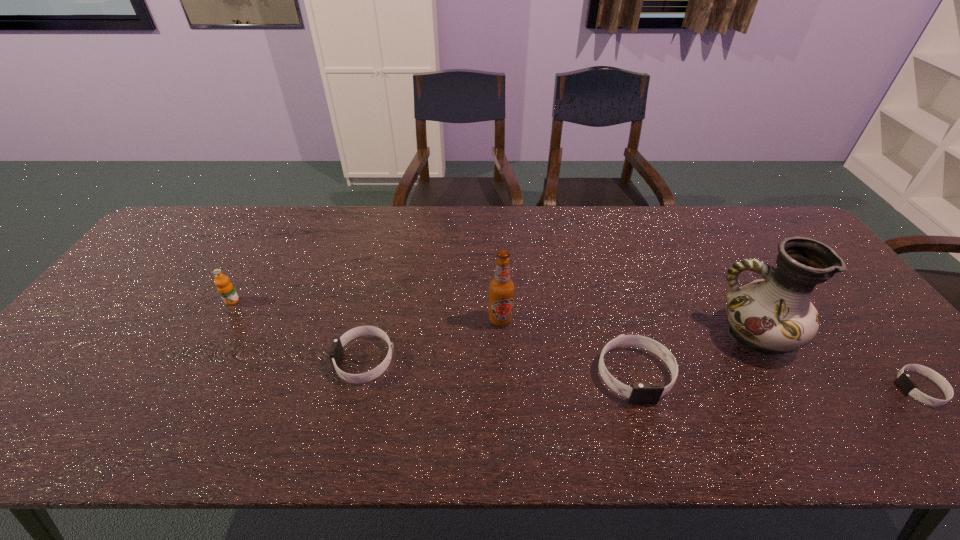
This screenshot has height=540, width=960. Identify the location of vacant area that lies between the leftmost wristband and the fifth object from left to right. (561, 348).

I want to click on free space between the second tallest wristband and the second tallest object, so click(x=433, y=340).

This screenshot has width=960, height=540. I want to click on blank region between the second object from left to right and the tallest object, so click(561, 348).

Identify the location of vacant area that lies between the shortest wristband and the orange juice. (576, 345).

The image size is (960, 540). I want to click on empty space between the fourth object from left to right and the tallest object, so click(x=695, y=354).

Locate an element on the screen. object that is the third closest one to the tallest object is located at coordinates (501, 287).

This screenshot has width=960, height=540. Identify the location of object that stands as the closest to the beer bottle. (640, 393).

Identify which wristband is located as the second nearest to the rightmost wristband. Please provide its 2D coordinates. Your answer should be formatted as a tuple, i.e. [(x, y)], where the tuple contains the x and y coordinates of a point satisfying the conditions above.

[(336, 352)]

The image size is (960, 540). I want to click on the second closest wristband to the tallest object, so click(904, 381).

This screenshot has height=540, width=960. Find the location of `blank space that satisfies the following two spatial constraints: 1. on the front label of the beer bottle; 2. on the outer surface of the fifth object from right to left`. blank space that satisfies the following two spatial constraints: 1. on the front label of the beer bottle; 2. on the outer surface of the fifth object from right to left is located at coordinates (502, 360).